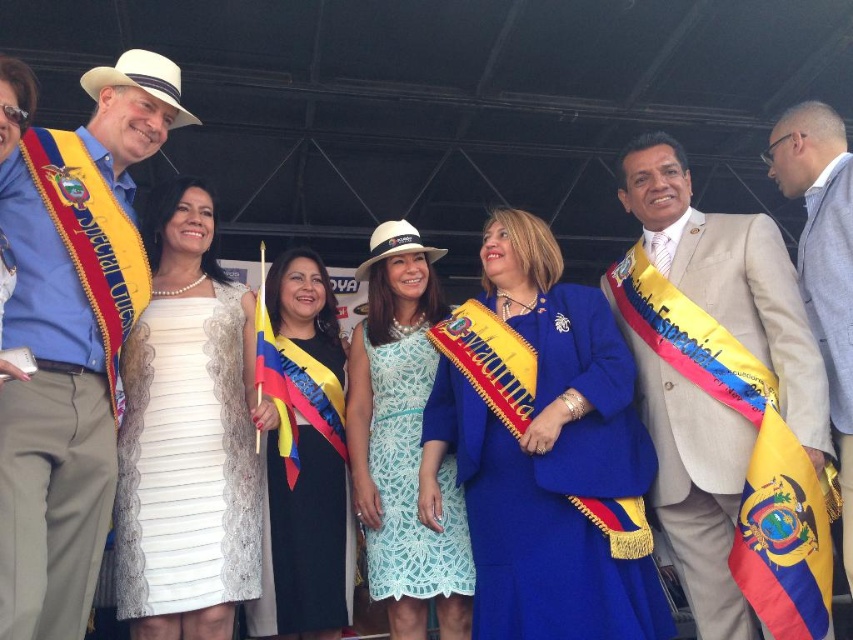
Question: Which object is the farthest from the yellow and red fabric flag at lower right?

Choices:
 (A) lace fabric dress at center
 (B) blue woolen coat at center

Answer: (A)

Question: Can you confirm if black satin dress at center is smaller than yellow and red fabric flag at lower right?

Choices:
 (A) no
 (B) yes

Answer: (A)

Question: Where is white woven hat at upper left located in relation to yellow and red fabric flag at lower right in the image?

Choices:
 (A) below
 (B) above

Answer: (B)

Question: Which object is positioned closest to the white lace dress at center?

Choices:
 (A) black satin dress at center
 (B) blue woolen coat at center
 (C) beige textured suit at center
 (D) lace fabric dress at center

Answer: (A)

Question: Can you confirm if black satin dress at center is smaller than yellow and red fabric flag at lower right?

Choices:
 (A) no
 (B) yes

Answer: (A)

Question: Which of the following is the closest to the observer?

Choices:
 (A) (679, 316)
 (B) (181, 108)

Answer: (A)